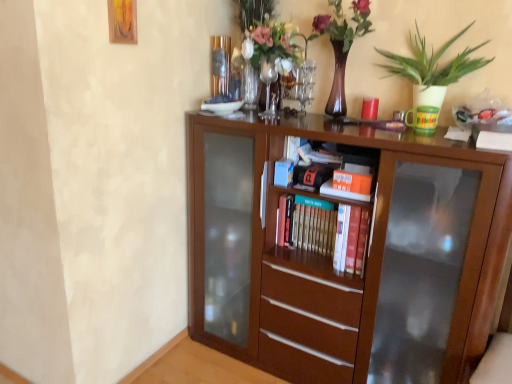
Locate an element on the screen. hardcover books at center, which is the second book in top-to-bottom order is located at coordinates (325, 230).

Find the location of a particular element. green matte plant at upper right is located at coordinates (431, 71).

From the image's perspective, is wooden picture frame at upper left above or below matte brown vase with flowers at upper center?

wooden picture frame at upper left is situated higher than matte brown vase with flowers at upper center in the image.

Looking at this image, considering the sizes of wooden picture frame at upper left and matte brown vase with flowers at upper center in the image, is wooden picture frame at upper left taller or shorter than matte brown vase with flowers at upper center?

In the image, wooden picture frame at upper left appears to be shorter than matte brown vase with flowers at upper center.

Considering the positions of objects wooden picture frame at upper left and matte brown vase with flowers at upper center in the image provided, who is more to the left, wooden picture frame at upper left or matte brown vase with flowers at upper center?

wooden picture frame at upper left.

From a real-world perspective, who is located lower, orange matte book at center, which ranks as the 1th book in top-to-bottom order, or brown wooden bookcase at center?

brown wooden bookcase at center is physically lower.

Is orange matte book at center, which is the second book from bottom to top, behind brown wooden bookcase at center?

Yes, orange matte book at center, which is the second book from bottom to top, is behind brown wooden bookcase at center.

This screenshot has width=512, height=384. Identify the location of bookcase in front of the orange matte book at center, placed as the first book when sorted from front to back. (344, 251).

You are a GUI agent. You are given a task and a screenshot of the screen. Output one action in this format:
    pyautogui.click(x=<x>, y=<y>)
    Task: Click on the 1st book behind when counting from the matte brown vase with flowers at upper center
    
    Given the screenshot: What is the action you would take?
    pyautogui.click(x=352, y=182)

Is matte brown vase with flowers at upper center inside or outside of orange matte book at center, which ranks as the 1th book in top-to-bottom order?

matte brown vase with flowers at upper center exists outside the volume of orange matte book at center, which ranks as the 1th book in top-to-bottom order.

Considering the positions of point (360, 2) and point (334, 172), is point (360, 2) closer or farther from the camera than point (334, 172)?

Point (360, 2) is farther from the camera than point (334, 172).

Find the location of `book lying behind the orange matte book at center, which ranks as the 1th book in top-to-bottom order`. book lying behind the orange matte book at center, which ranks as the 1th book in top-to-bottom order is located at coordinates (325, 230).

From a real-world perspective, is hardcover books at center, which is the second book in top-to-bottom order, physically above orange matte book at center, which ranks as the 1th book in top-to-bottom order?

No, from a real-world perspective, hardcover books at center, which is the second book in top-to-bottom order, is not above orange matte book at center, which ranks as the 1th book in top-to-bottom order.

Which object is closer to the camera taking this photo, hardcover books at center, which is the second book in top-to-bottom order, or orange matte book at center, which ranks as the 1th book in top-to-bottom order?

orange matte book at center, which ranks as the 1th book in top-to-bottom order.

Which object is positioned more to the right, brown wooden bookcase at center or green matte plant at upper right?

green matte plant at upper right is more to the right.

Is brown wooden bookcase at center facing away from green matte plant at upper right?

brown wooden bookcase at center is not turned away from green matte plant at upper right.

Considering the relative sizes of brown wooden bookcase at center and green matte plant at upper right in the image provided, is brown wooden bookcase at center thinner than green matte plant at upper right?

Incorrect, the width of brown wooden bookcase at center is not less than that of green matte plant at upper right.

Considering their positions, is matte brown vase with flowers at upper center located in front of or behind wooden picture frame at upper left?

matte brown vase with flowers at upper center is positioned farther from the viewer than wooden picture frame at upper left.

Considering the sizes of objects matte brown vase with flowers at upper center and wooden picture frame at upper left in the image provided, who is shorter, matte brown vase with flowers at upper center or wooden picture frame at upper left?

wooden picture frame at upper left.

This screenshot has width=512, height=384. I want to click on picture frame positioned vertically above the matte brown vase with flowers at upper center (from a real-world perspective), so pos(122,21).

From the image's perspective, is brown wooden bookcase at center under hardcover books at center, the 2th book viewed from the front?

Yes.

Image resolution: width=512 pixels, height=384 pixels. I want to click on bookcase lying below the hardcover books at center, acting as the 1th book starting from the bottom (from the image's perspective), so click(344, 251).

Is brown wooden bookcase at center further to the viewer compared to hardcover books at center, the 2th book viewed from the front?

No, brown wooden bookcase at center is in front of hardcover books at center, the 2th book viewed from the front.

Is brown wooden bookcase at center not close to hardcover books at center, which is the second book in top-to-bottom order?

No, there isn't a large distance between brown wooden bookcase at center and hardcover books at center, which is the second book in top-to-bottom order.

Identify the location of picture frame that appears on the left of matte brown vase with flowers at upper center. (122, 21).

From the image's perspective, count 2nd books upward from the brown wooden bookcase at center and point to it. Please provide its 2D coordinates.

[(352, 182)]

When comparing their distances from orange matte book at center, which is the second book from bottom to top, does wooden picture frame at upper left or matte brown vase with flowers at upper center seem closer?

Among the two, matte brown vase with flowers at upper center is located nearer to orange matte book at center, which is the second book from bottom to top.

From the image, which object appears to be nearer to hardcover books at center, the 2th book viewed from the front, brown wooden bookcase at center or matte brown vase with flowers at upper center?

brown wooden bookcase at center is closer to hardcover books at center, the 2th book viewed from the front.

Estimate the real-world distances between objects in this image. Which object is further from wooden picture frame at upper left, orange matte book at center, placed as the first book when sorted from front to back, or matte brown vase with flowers at upper center?

orange matte book at center, placed as the first book when sorted from front to back, lies further to wooden picture frame at upper left than the other object.

Based on their spatial positions, is brown wooden bookcase at center or wooden picture frame at upper left further from hardcover books at center, placed as the first book when sorted from back to front?

Among the two, wooden picture frame at upper left is located further to hardcover books at center, placed as the first book when sorted from back to front.

Looking at the image, which one is located further to orange matte book at center, the 2th book positioned from the back, hardcover books at center, which is the second book in top-to-bottom order, or green matte plant at upper right?

green matte plant at upper right is positioned further to the anchor orange matte book at center, the 2th book positioned from the back.

Estimate the real-world distances between objects in this image. Which object is further from brown wooden bookcase at center, hardcover books at center, the 2th book viewed from the front, or orange matte book at center, placed as the first book when sorted from front to back?

orange matte book at center, placed as the first book when sorted from front to back, is positioned further to the anchor brown wooden bookcase at center.

From the image, which object appears to be farther from hardcover books at center, placed as the first book when sorted from back to front, matte brown vase with flowers at upper center or green matte plant at upper right?

matte brown vase with flowers at upper center lies further to hardcover books at center, placed as the first book when sorted from back to front, than the other object.

Based on their spatial positions, is wooden picture frame at upper left or brown wooden bookcase at center closer to hardcover books at center, placed as the first book when sorted from back to front?

brown wooden bookcase at center.

Identify the location of book between matte brown vase with flowers at upper center and hardcover books at center, the 2th book viewed from the front, in the vertical direction. (352, 182).

What are the coordinates of `floral arrangement situated between wooden picture frame at upper left and orange matte book at center, which is the second book from bottom to top, from left to right` in the screenshot? It's located at click(341, 45).

Where is `houseplant that lies between matte brown vase with flowers at upper center and brown wooden bookcase at center from top to bottom`? The height and width of the screenshot is (384, 512). houseplant that lies between matte brown vase with flowers at upper center and brown wooden bookcase at center from top to bottom is located at coordinates (431, 71).

I want to click on houseplant between matte brown vase with flowers at upper center and hardcover books at center, placed as the first book when sorted from back to front, in the up-down direction, so click(x=431, y=71).